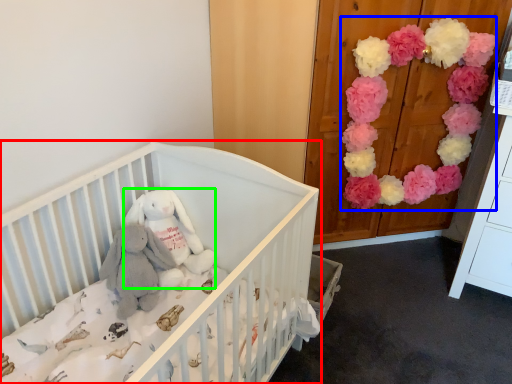
Question: Based on their relative distances, which object is nearer to infant bed (highlighted by a red box)? Choose from flower (highlighted by a blue box) and toy (highlighted by a green box).

Choices:
 (A) flower
 (B) toy

Answer: (B)